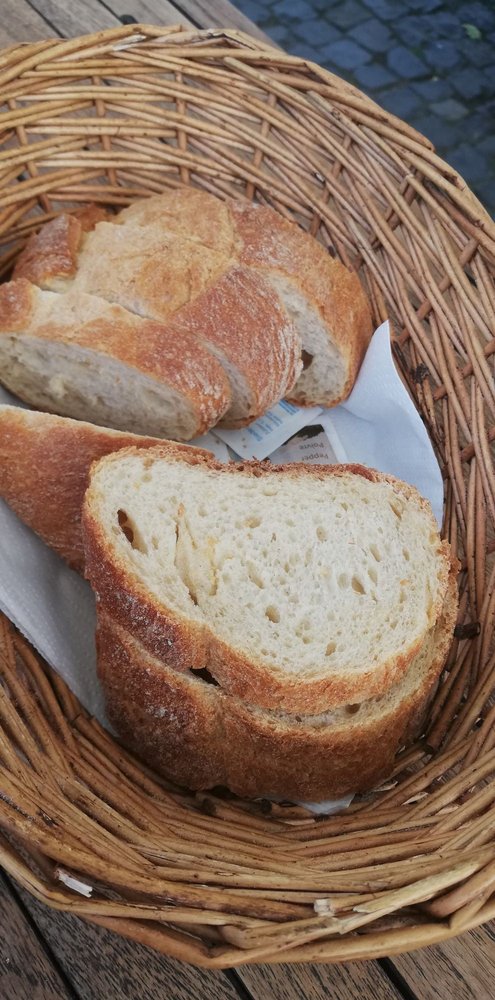
Image resolution: width=495 pixels, height=1000 pixels. Find the location of `napkin at bottom of basket`. napkin at bottom of basket is located at coordinates (377, 434).